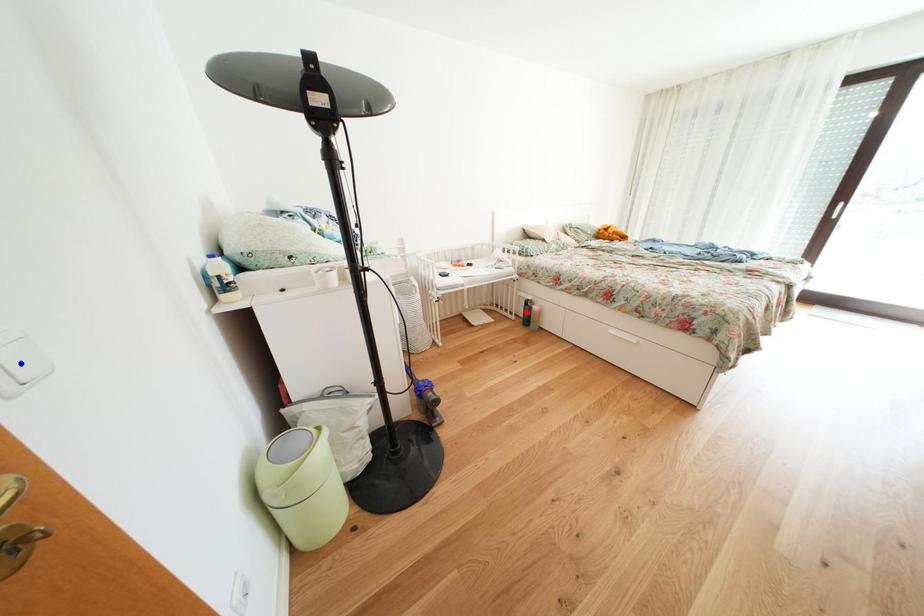
Question: In the image, two points are highlighted. Which point is nearer to the camera? Reply with the corresponding letter.

Choices:
 (A) blue point
 (B) red point

Answer: (A)